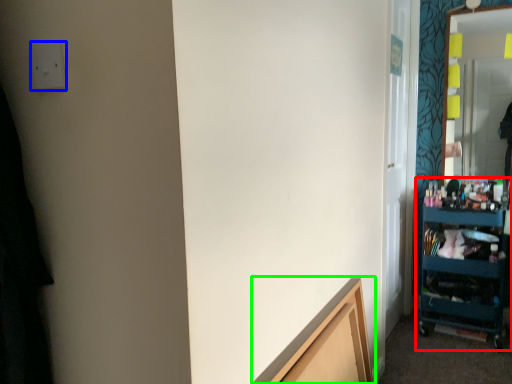
Question: Which is nearer to the shelf (highlighted by a red box)? electric outlet (highlighted by a blue box) or cabinetry (highlighted by a green box).

Choices:
 (A) electric outlet
 (B) cabinetry

Answer: (B)